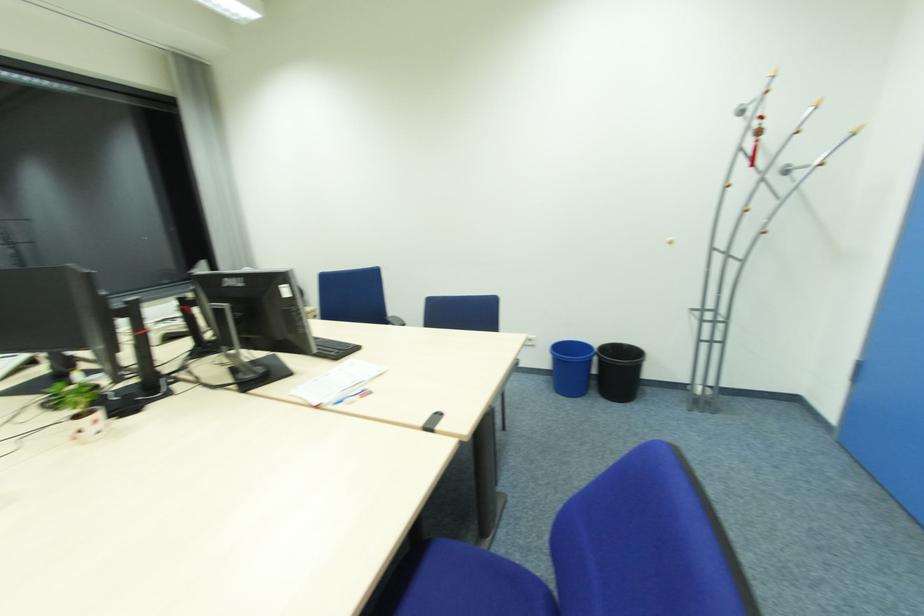
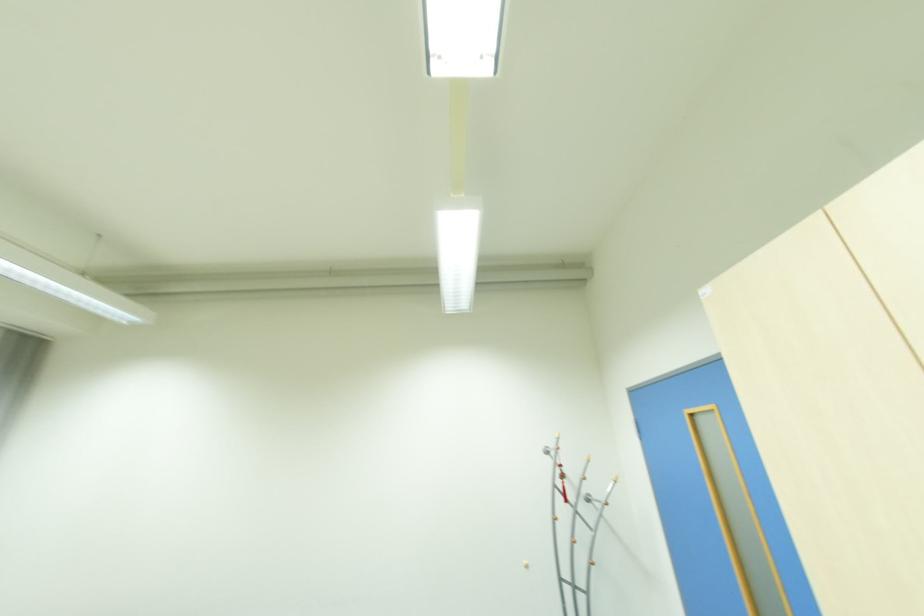
How did the camera likely rotate?

The rotation direction of the camera is right-up.